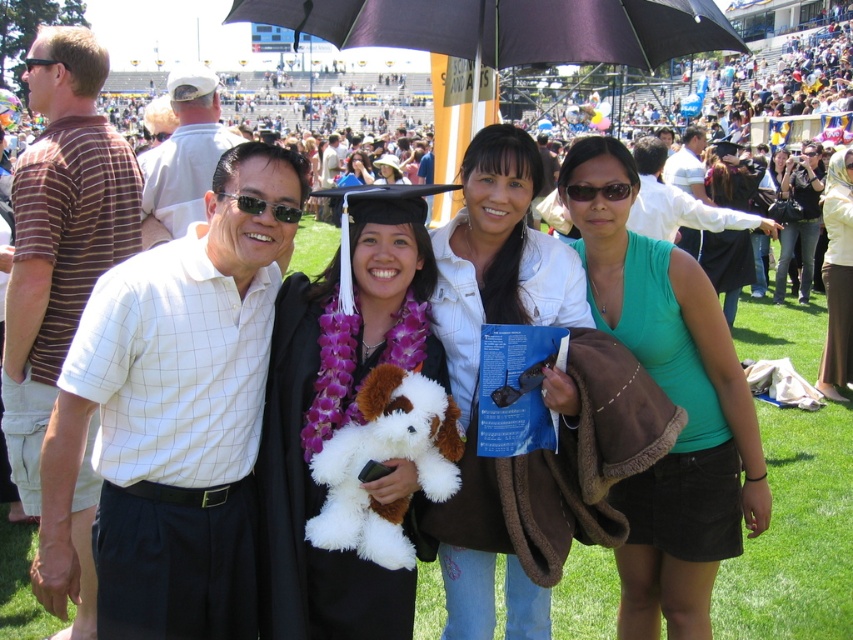
Question: Which point is farther from the camera taking this photo?

Choices:
 (A) (386, 173)
 (B) (653, 598)
 (C) (726, 28)

Answer: (A)

Question: Can you confirm if light brown fabric skirt at lower right is wider than purple fabric lei at center?

Choices:
 (A) yes
 (B) no

Answer: (A)

Question: Among these points, which one is nearest to the camera?

Choices:
 (A) (427, 250)
 (B) (712, 499)

Answer: (B)

Question: Can you confirm if green fabric shirt at center is bigger than white denim jacket at center?

Choices:
 (A) yes
 (B) no

Answer: (A)

Question: Which object is positioned farthest from the black fabric umbrella at upper center?

Choices:
 (A) light brown fabric skirt at lower right
 (B) white plush teddy bear at center

Answer: (A)

Question: Is white denim jacket at center closer to camera compared to black fabric umbrella at upper center?

Choices:
 (A) no
 (B) yes

Answer: (A)